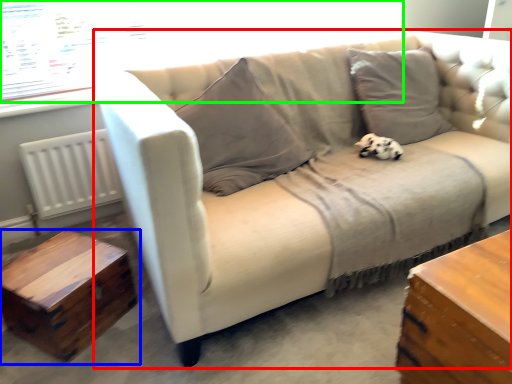
Question: Considering the real-world distances, which object is farthest from studio couch (highlighted by a red box)? table (highlighted by a blue box) or window screen (highlighted by a green box)?

Choices:
 (A) table
 (B) window screen

Answer: (B)